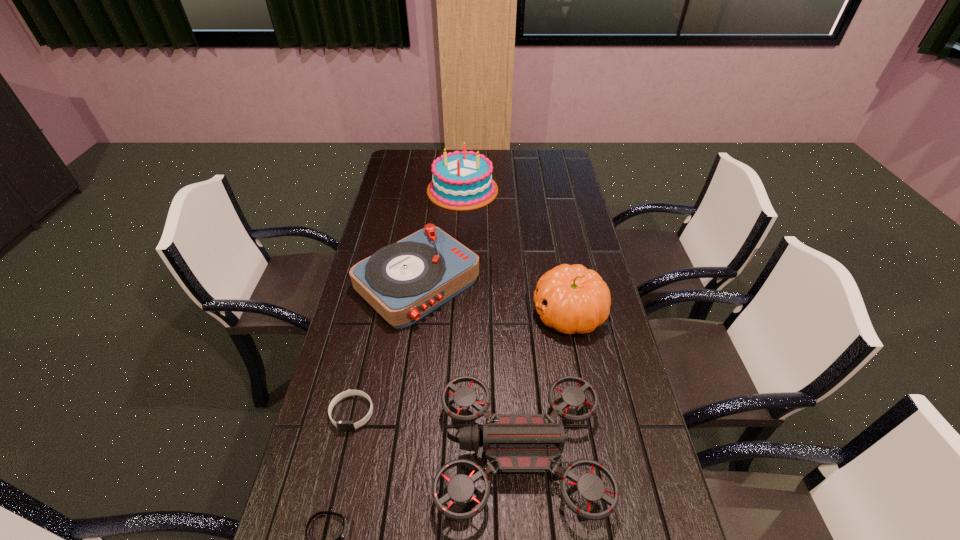
The width and height of the screenshot is (960, 540). What are the coordinates of `empty location between the pumpkin and the record player` in the screenshot? It's located at pyautogui.click(x=493, y=298).

Locate an element on the screen. vacant area that lies between the drone and the pumpkin is located at coordinates pyautogui.click(x=544, y=383).

Where is `the closest object to the birthday cake`? the closest object to the birthday cake is located at coordinates (404, 281).

The height and width of the screenshot is (540, 960). In order to click on object that is the third closest one to the pumpkin in this screenshot , I will do `click(461, 181)`.

The width and height of the screenshot is (960, 540). I want to click on free space that satisfies the following two spatial constraints: 1. on the carved face of the second tallest object; 2. on the outer surface of the farther wristband, so click(x=588, y=413).

This screenshot has width=960, height=540. Identify the location of free space that satisfies the following two spatial constraints: 1. on the carved face of the fifth shortest object; 2. on the outer surface of the taller wristband. (588, 413).